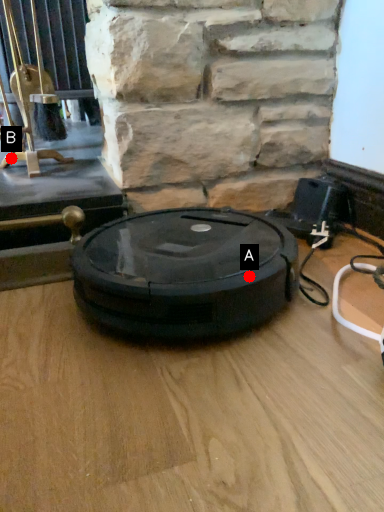
Question: Two points are circled on the image, labeled by A and B beside each circle. Which point is closer to the camera?

Choices:
 (A) A is closer
 (B) B is closer

Answer: (A)